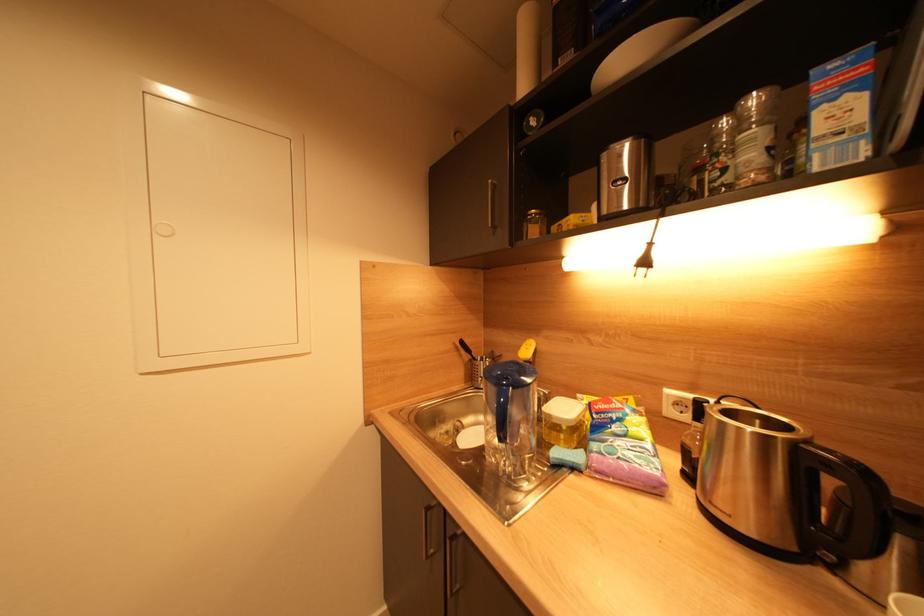
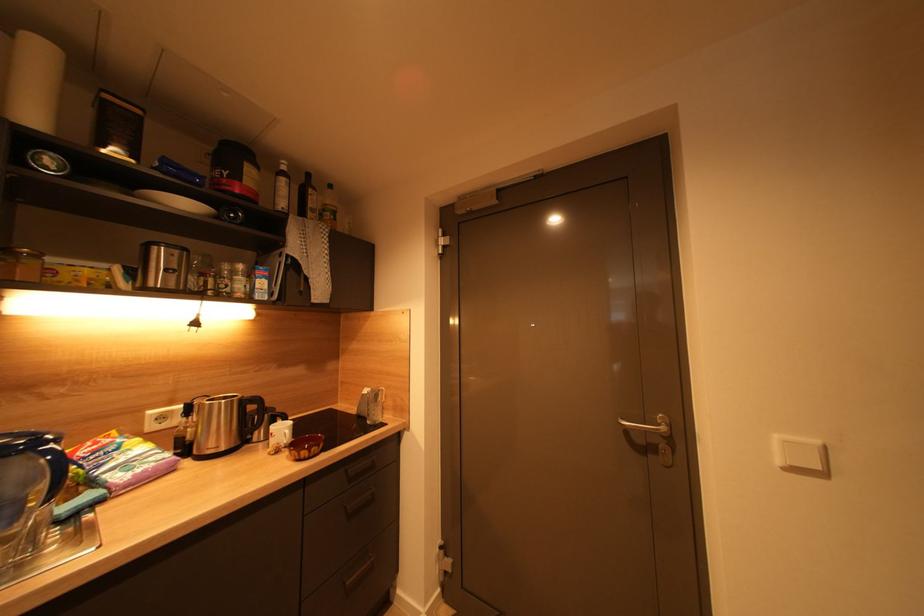
Question: Based on the continuous images, in which direction is the camera rotating? Reply with the corresponding letter.

Choices:
 (A) Left
 (B) Right
 (C) Up
 (D) Down

Answer: (B)